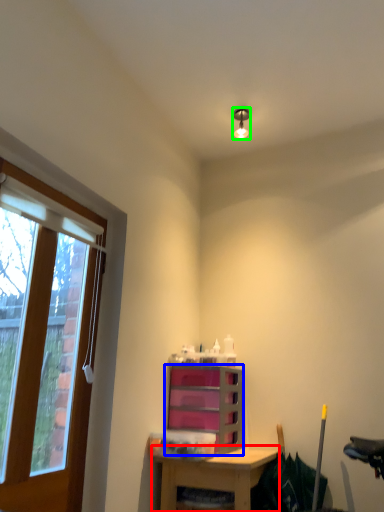
Question: Which is nearer to the desk (highlighted by a red box)? cabinetry (highlighted by a blue box) or light fixture (highlighted by a green box).

Choices:
 (A) cabinetry
 (B) light fixture

Answer: (A)